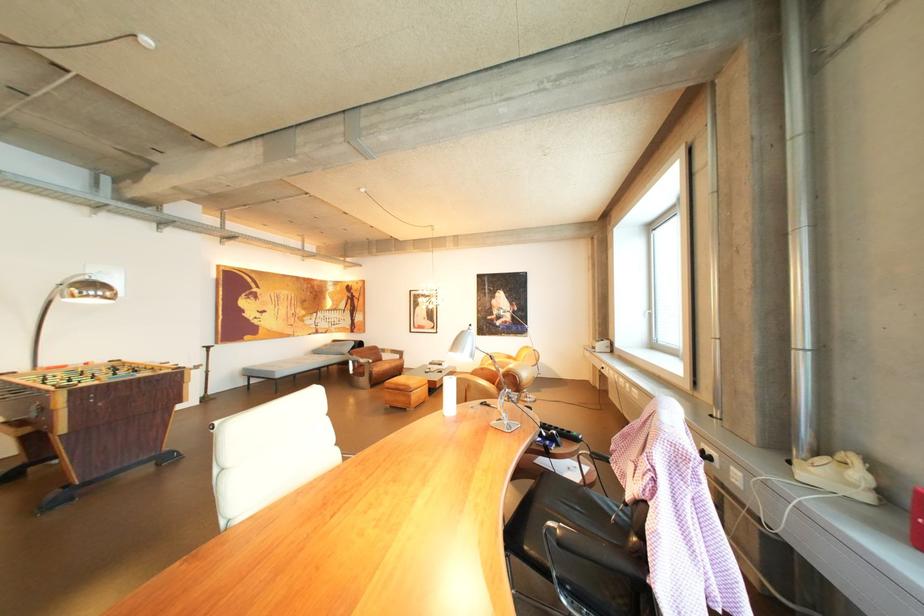
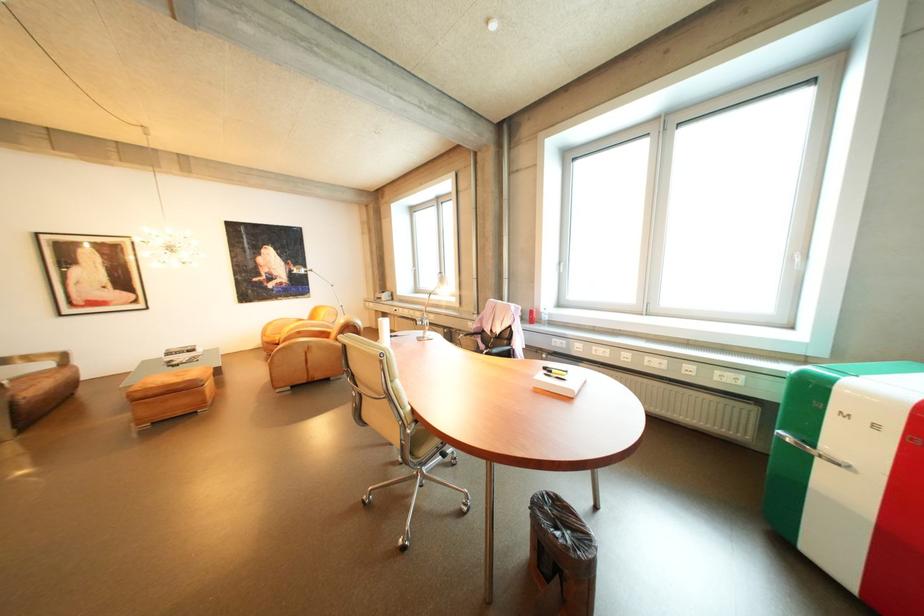
In the second image, find the point that corresponds to (523,305) in the first image.

(296, 264)